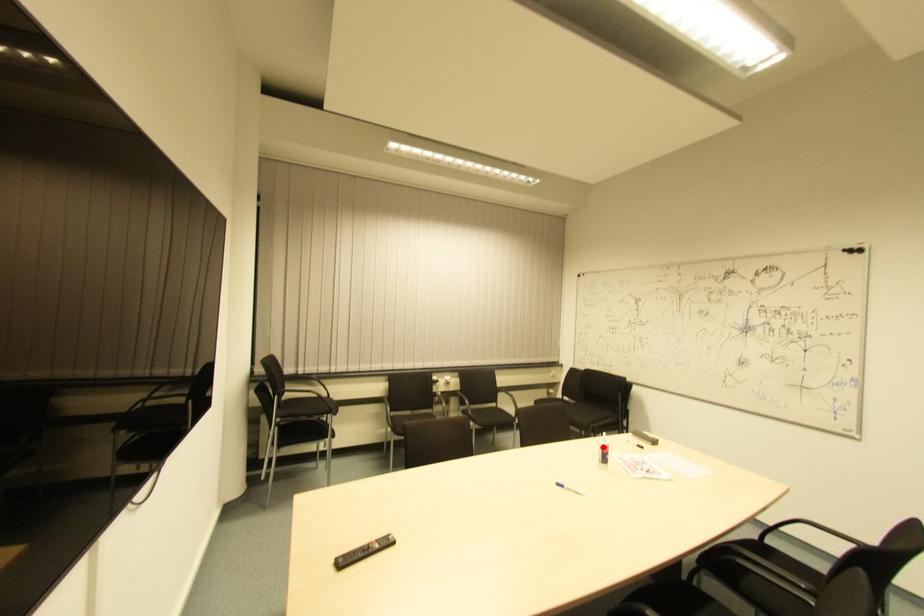
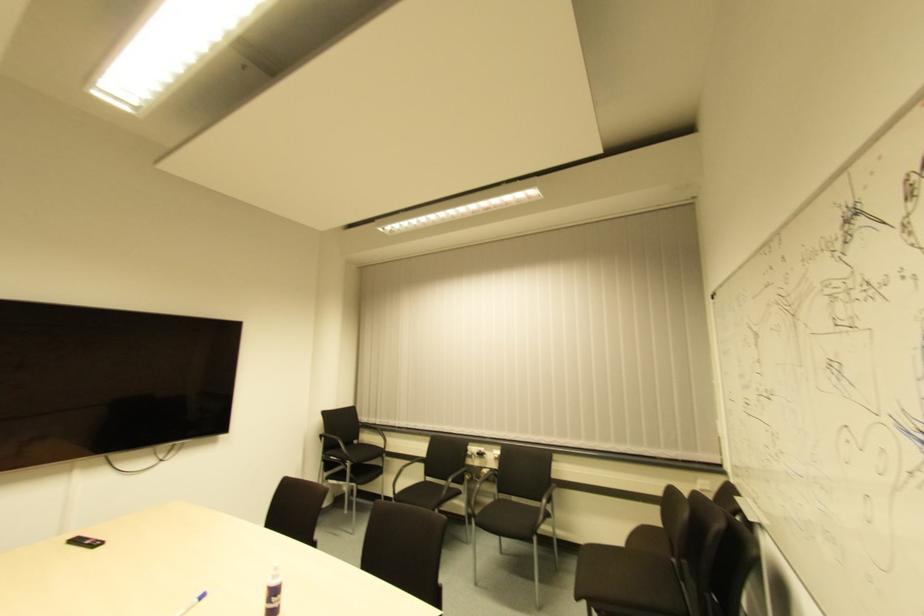
Question: I am providing you with two images of the same scene from different viewpoints. Given a red point in image1, look at the same physical point in image2. Is it:

Choices:
 (A) Closer to the viewpoint
 (B) Farther from the viewpoint

Answer: (B)